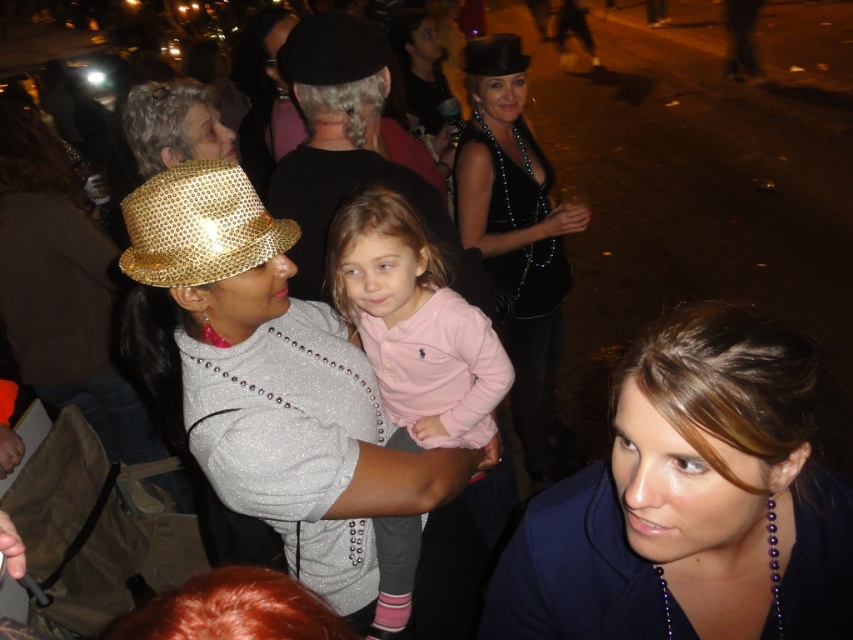
In the festive nighttime scene, there is a shiny black dress at center and a black felt hat at upper center. From the perspective of someone standing in front of the image, which object is positioned to the right?

The shiny black dress at center is to the right of the black felt hat at upper center.